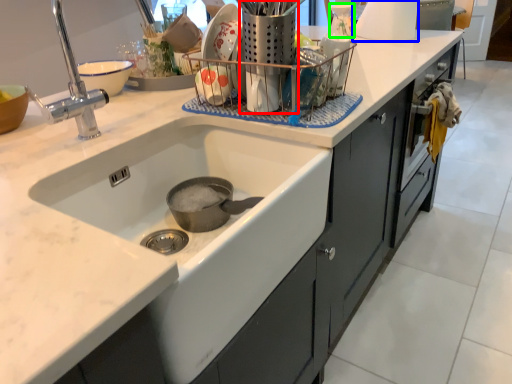
Question: Which object is positioned farthest from appliance (highlighted by a red box)? Select from appliance (highlighted by a blue box) and appliance (highlighted by a green box).

Choices:
 (A) appliance
 (B) appliance

Answer: (A)